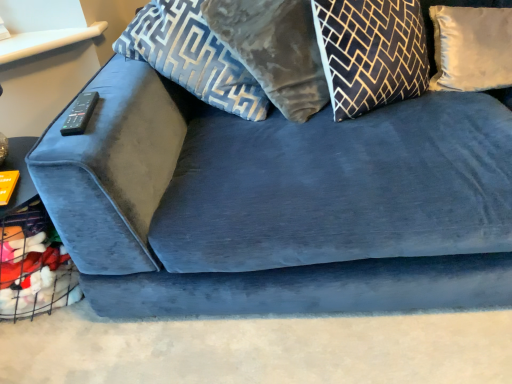
Question: Is black and gold geometric pillow at upper center, which is the second pillow in right-to-left order, shorter than black plastic remote at upper left?

Choices:
 (A) no
 (B) yes

Answer: (A)

Question: Can you confirm if black and gold geometric pillow at upper center, which is the second pillow in right-to-left order, is bigger than black plastic remote at upper left?

Choices:
 (A) yes
 (B) no

Answer: (A)

Question: From a real-world perspective, is black and gold geometric pillow at upper center, which is the second pillow in right-to-left order, located beneath black plastic remote at upper left?

Choices:
 (A) no
 (B) yes

Answer: (B)

Question: Is the depth of black and gold geometric pillow at upper center, which appears as the third pillow when viewed from the left, greater than that of black plastic remote at upper left?

Choices:
 (A) yes
 (B) no

Answer: (A)

Question: From the image's perspective, is black and gold geometric pillow at upper center, which appears as the third pillow when viewed from the left, beneath black plastic remote at upper left?

Choices:
 (A) no
 (B) yes

Answer: (A)

Question: Is velvet gray pillow at upper center, which appears as the 3th pillow when viewed from the right, inside the boundaries of white satin pillow at upper right, which is the first pillow in right-to-left order, or outside?

Choices:
 (A) outside
 (B) inside

Answer: (A)

Question: From the image's perspective, relative to white satin pillow at upper right, which is the first pillow in right-to-left order, is velvet gray pillow at upper center, which appears as the 3th pillow when viewed from the right, above or below?

Choices:
 (A) above
 (B) below

Answer: (A)

Question: Considering the positions of velvet gray pillow at upper center, placed as the second pillow when sorted from left to right, and white satin pillow at upper right, placed as the fourth pillow when sorted from left to right, in the image, is velvet gray pillow at upper center, placed as the second pillow when sorted from left to right, wider or thinner than white satin pillow at upper right, placed as the fourth pillow when sorted from left to right,?

Choices:
 (A) wide
 (B) thin

Answer: (A)

Question: From a real-world perspective, is velvet gray pillow at upper center, placed as the second pillow when sorted from left to right, above or below white satin pillow at upper right, placed as the fourth pillow when sorted from left to right?

Choices:
 (A) below
 (B) above

Answer: (B)

Question: From the image's perspective, is velvet blue pillow at upper center, acting as the fourth pillow starting from the right, positioned above or below black plastic remote at upper left?

Choices:
 (A) above
 (B) below

Answer: (A)

Question: From their relative heights in the image, would you say velvet blue pillow at upper center, which ranks as the first pillow in left-to-right order, is taller or shorter than black plastic remote at upper left?

Choices:
 (A) short
 (B) tall

Answer: (B)

Question: Is point (196, 81) positioned closer to the camera than point (74, 119)?

Choices:
 (A) farther
 (B) closer

Answer: (A)

Question: Considering the positions of velvet blue pillow at upper center, acting as the fourth pillow starting from the right, and black plastic remote at upper left in the image, is velvet blue pillow at upper center, acting as the fourth pillow starting from the right, wider or thinner than black plastic remote at upper left?

Choices:
 (A) wide
 (B) thin

Answer: (A)

Question: Is point (436, 64) positioned closer to the camera than point (150, 36)?

Choices:
 (A) farther
 (B) closer

Answer: (A)

Question: Considering the positions of white satin pillow at upper right, placed as the fourth pillow when sorted from left to right, and velvet blue pillow at upper center, which ranks as the first pillow in left-to-right order, in the image, is white satin pillow at upper right, placed as the fourth pillow when sorted from left to right, wider or thinner than velvet blue pillow at upper center, which ranks as the first pillow in left-to-right order,?

Choices:
 (A) wide
 (B) thin

Answer: (B)